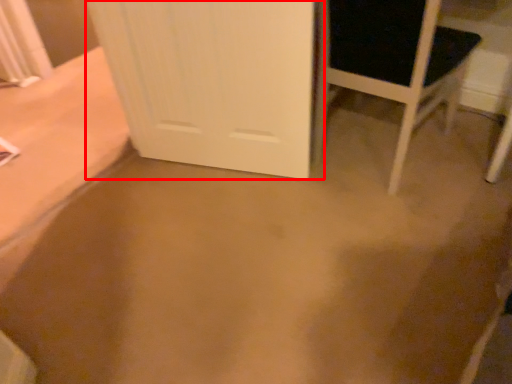
Question: Considering the relative positions of door (annotated by the red box) and chair in the image provided, where is door (annotated by the red box) located with respect to the staircase?

Choices:
 (A) left
 (B) right

Answer: (A)